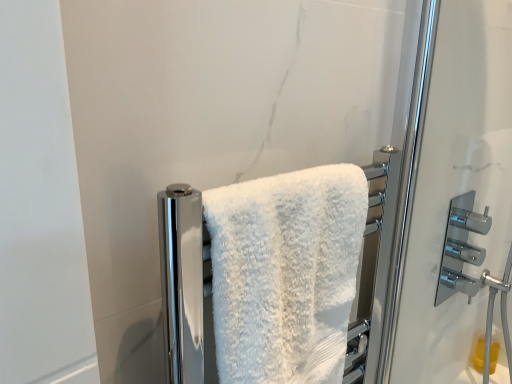
Question: From a real-world perspective, relative to white fluffy towel at center, is polished chrome faucet at right vertically above or below?

Choices:
 (A) above
 (B) below

Answer: (B)

Question: Is point (434, 302) closer or farther from the camera than point (263, 276)?

Choices:
 (A) farther
 (B) closer

Answer: (A)

Question: In the image, is polished chrome faucet at right on the left side or the right side of white fluffy towel at center?

Choices:
 (A) left
 (B) right

Answer: (B)

Question: Considering the positions of white fluffy towel at center and polished chrome faucet at right in the image, is white fluffy towel at center bigger or smaller than polished chrome faucet at right?

Choices:
 (A) big
 (B) small

Answer: (A)

Question: From the image's perspective, is white fluffy towel at center located above or below polished chrome faucet at right?

Choices:
 (A) above
 (B) below

Answer: (B)

Question: In the image, is white fluffy towel at center on the left side or the right side of polished chrome faucet at right?

Choices:
 (A) right
 (B) left

Answer: (B)

Question: From a real-world perspective, is white fluffy towel at center positioned above or below polished chrome faucet at right?

Choices:
 (A) above
 (B) below

Answer: (A)